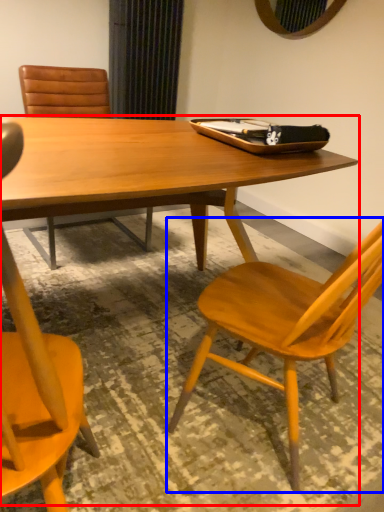
Question: Which object is closer to the camera taking this photo, round table (highlighted by a red box) or chair (highlighted by a blue box)?

Choices:
 (A) round table
 (B) chair

Answer: (B)